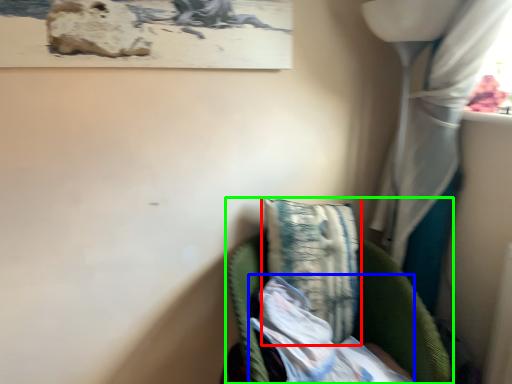
Question: Which object is positioned farthest from pillow (highlighted by a red box)? Select from wrapping paper (highlighted by a blue box) and furniture (highlighted by a green box).

Choices:
 (A) wrapping paper
 (B) furniture

Answer: (A)